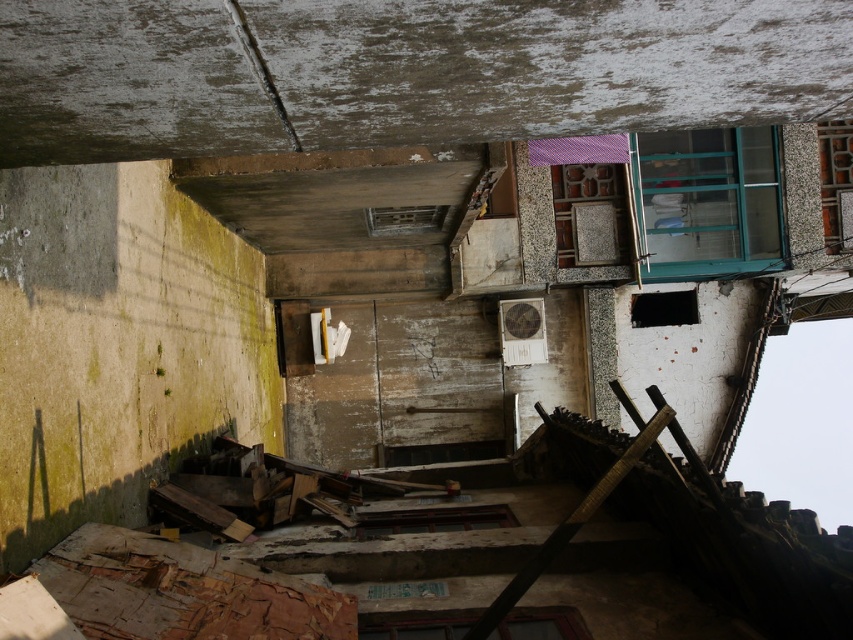
You are an architect assessing the structural integrity of the building. You notice the green glass window at upper right and the brown wooden window at lower center. Which window has a greater width according to the scene?

The green glass window at upper right has a greater width than the brown wooden window at lower center.

You are standing in the alleyway looking up. A green glass window is located at the upper right. If you were to draw a straight line from your eye level to the green glass window at upper right, would it pass through any of the debris or wooden planks in the middle ground?

The green glass window at upper right is positioned at point (708, 202), so the straight line from your eye level would not pass through any debris or wooden planks in the middle ground since the window is above them.